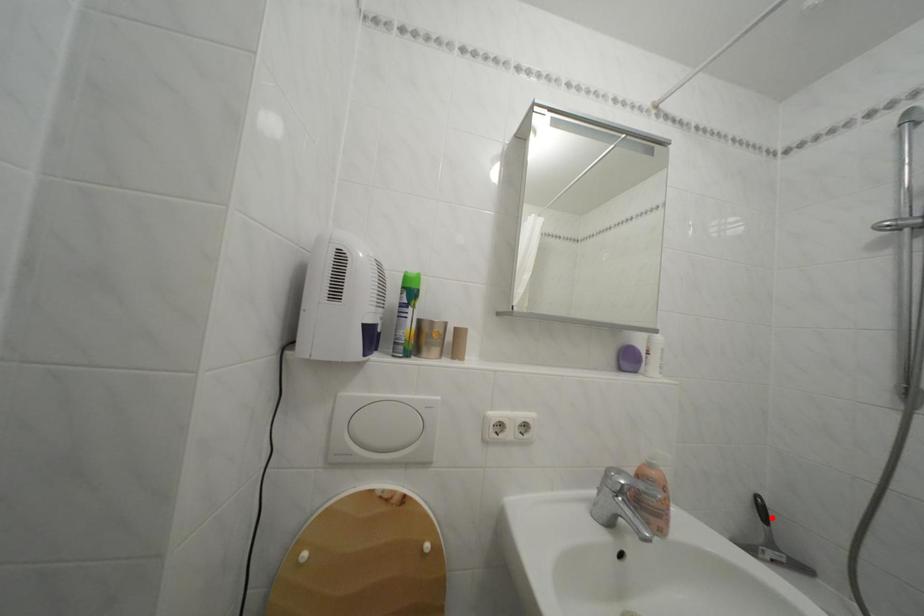
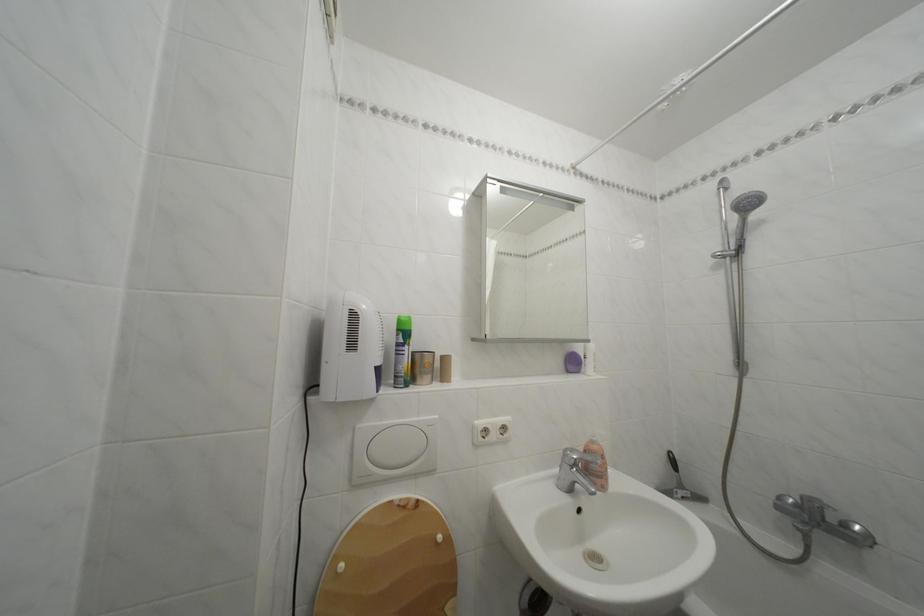
Locate, in the second image, the point that corresponds to the highlighted location in the first image.

(682, 468)